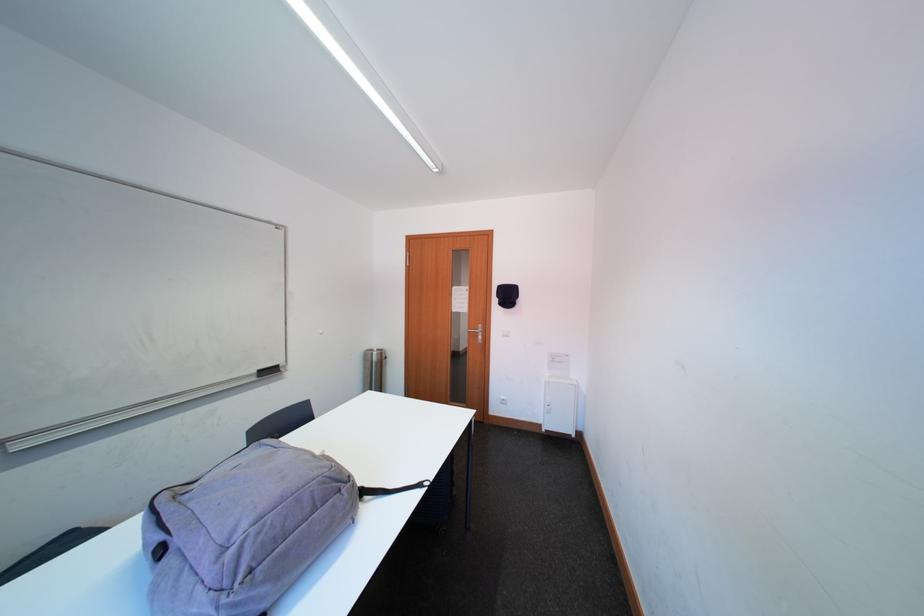
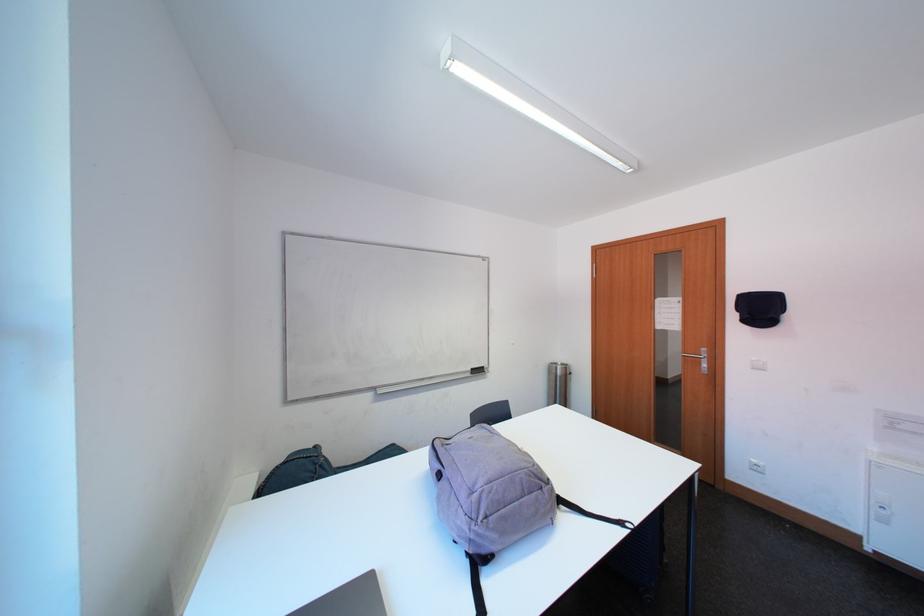
Find the pixel in the second image that matches [349,493] in the first image.

(551, 492)